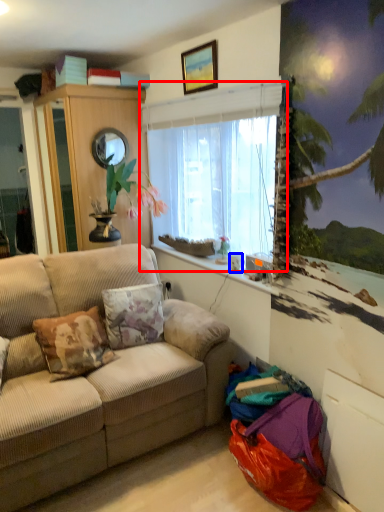
Question: Which of the following is the closest to the observer, window (highlighted by a red box) or coffee cup (highlighted by a blue box)?

Choices:
 (A) window
 (B) coffee cup

Answer: (A)